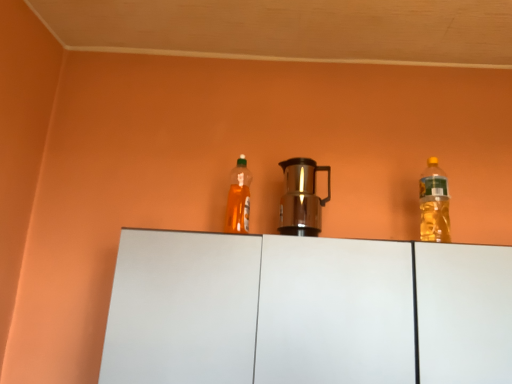
Question: Visually, is shiny metallic coffee pot at center positioned to the left or to the right of translucent yellow bottle at right, the 1th bottle from the right?

Choices:
 (A) left
 (B) right

Answer: (A)

Question: In terms of size, does shiny metallic coffee pot at center appear bigger or smaller than translucent yellow bottle at right, the 2th bottle in the left-to-right sequence?

Choices:
 (A) small
 (B) big

Answer: (B)

Question: Considering the real-world distances, which object is closest to the translucent orange bottle at center, placed as the 2th bottle when sorted from right to left?

Choices:
 (A) translucent yellow bottle at right, the 1th bottle from the right
 (B) shiny metallic coffee pot at center
 (C) white matte cabinet at center

Answer: (B)

Question: Which is farther from the translucent yellow bottle at right, the 2th bottle in the left-to-right sequence?

Choices:
 (A) white matte cabinet at center
 (B) translucent orange bottle at center, which is counted as the 1th bottle, starting from the left
 (C) shiny metallic coffee pot at center

Answer: (B)